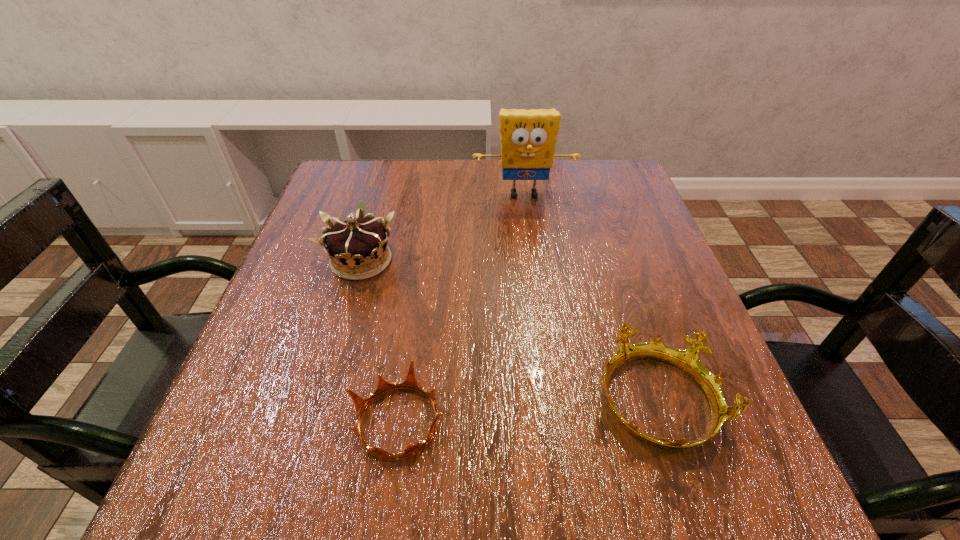
In order to click on unoccupied position between the third shortest object and the shortest object in this screenshot , I will do `click(380, 341)`.

Where is `vacant space in between the second tallest crown and the farthest crown`? vacant space in between the second tallest crown and the farthest crown is located at coordinates (509, 331).

In order to click on free space between the sponge and the shortest object in this screenshot , I will do `click(461, 308)`.

I want to click on object that stands as the third closest to the sponge, so click(410, 382).

Locate which object ranks third in proximity to the second tallest crown. Please provide its 2D coordinates. Your answer should be formatted as a tuple, i.e. [(x, y)], where the tuple contains the x and y coordinates of a point satisfying the conditions above.

[(528, 137)]

Identify the location of crown that is the closest one to the second tallest object. (410, 382).

In order to click on crown that is the second closest one to the farthest object in this screenshot , I will do `click(687, 360)`.

You are a GUI agent. You are given a task and a screenshot of the screen. Output one action in this format:
    pyautogui.click(x=<x>, y=<y>)
    Task: Click on the free space that satisfies the following two spatial constraints: 1. on the face of the third tallest object; 2. on the right side of the sponge
    The height and width of the screenshot is (540, 960).
    Given the screenshot: What is the action you would take?
    pyautogui.click(x=550, y=402)